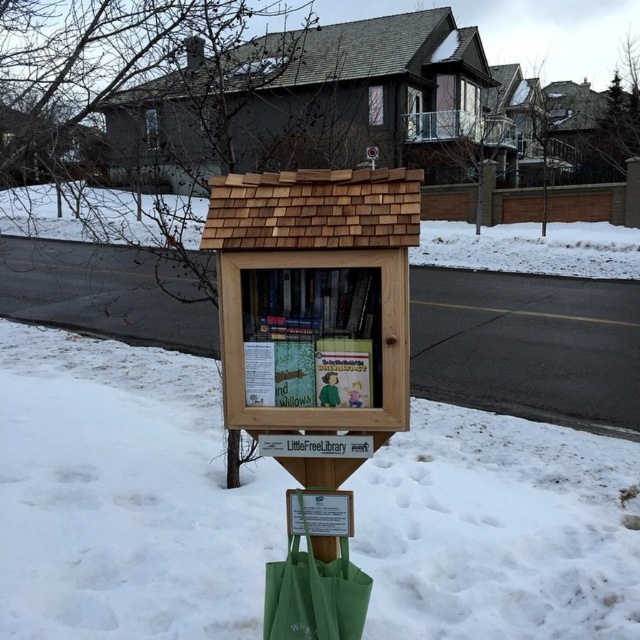
How far apart are hardcover book at center and green canvas bag at lower center?

They are 17.73 inches apart.

Between point (374, 346) and point (339, 611), which one is positioned in front?

Point (374, 346)

Between point (348, 348) and point (280, 627), which one is positioned behind?

Point (280, 627)

Find the location of a particular element. Image resolution: width=640 pixels, height=640 pixels. hardcover book at center is located at coordinates (310, 337).